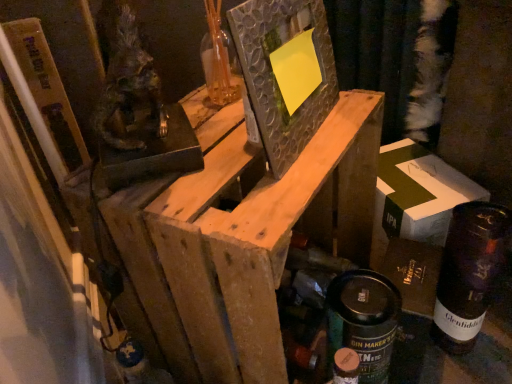
Where is `free space above wooden frame at center (from a real-world perspective)`? This screenshot has width=512, height=384. free space above wooden frame at center (from a real-world perspective) is located at coordinates (238, 134).